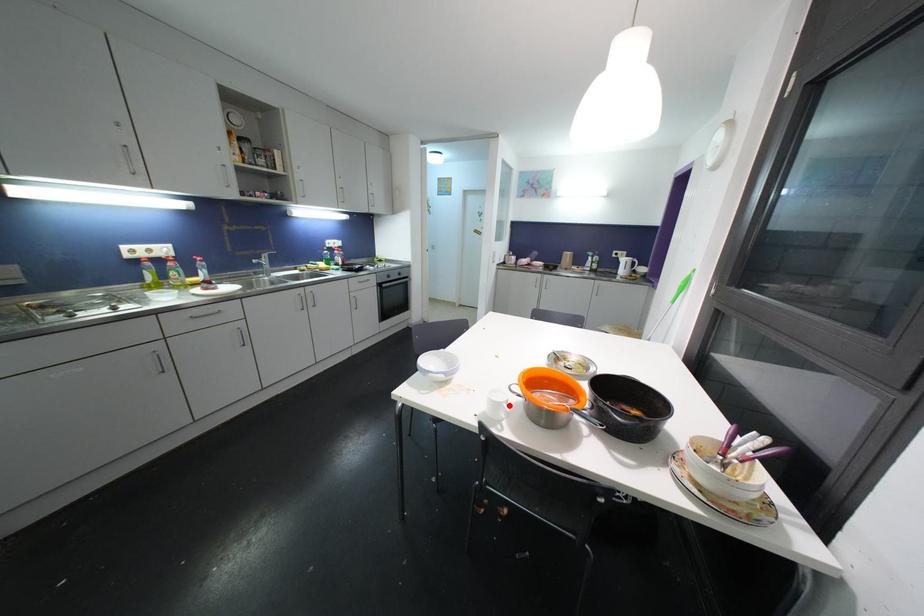
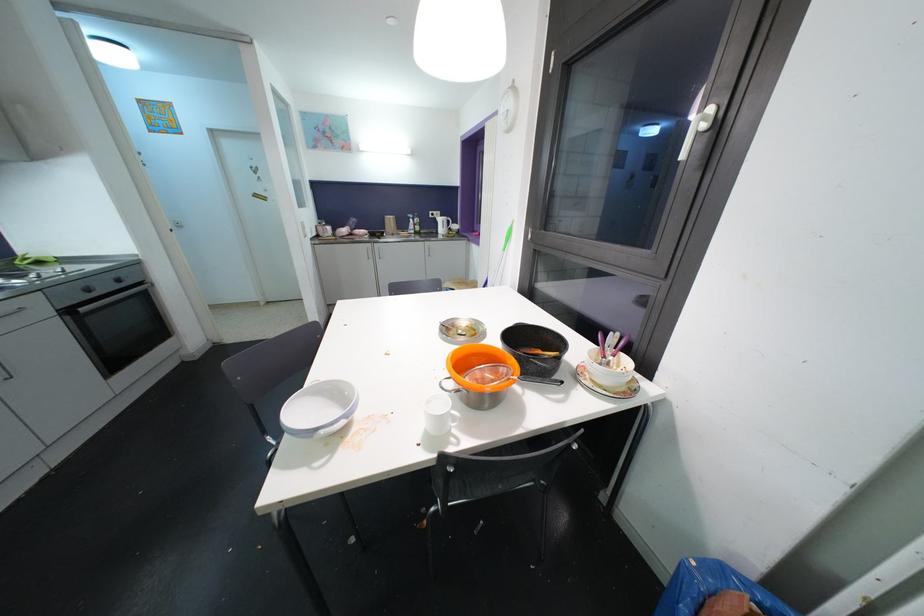
In the second image, find the point that corresponds to the highlighted location in the first image.

(456, 411)